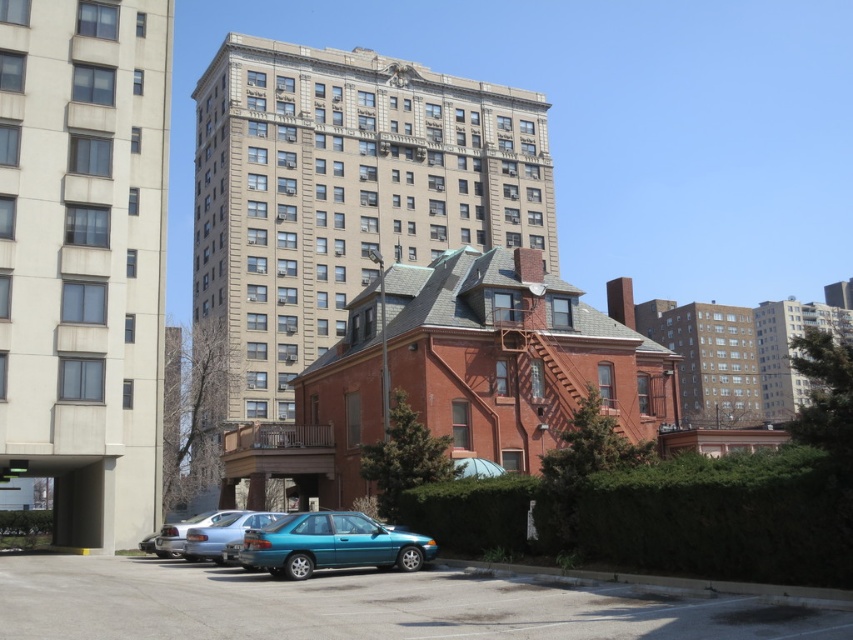
Which is more to the left, beige concrete building at center or teal glossy sedan at lower center?

beige concrete building at center

Who is more forward, (49, 218) or (294, 544)?

Point (294, 544)

The image size is (853, 640). Identify the location of beige concrete building at center. pyautogui.click(x=84, y=259).

What do you see at coordinates (344, 193) in the screenshot? This screenshot has height=640, width=853. I see `beige stone building at center` at bounding box center [344, 193].

Is beige stone building at center shorter than matte silver sedan at lower left?

In fact, beige stone building at center may be taller than matte silver sedan at lower left.

At what (x,y) coordinates should I click in order to perform the action: click on beige stone building at center. Please return your answer as a coordinate pair (x, y). The height and width of the screenshot is (640, 853). Looking at the image, I should click on (344, 193).

Locate an element on the screen. Image resolution: width=853 pixels, height=640 pixels. matte silver sedan at lower left is located at coordinates (223, 532).

Which is above, matte silver sedan at lower left or satin silver sedan at lower left?

matte silver sedan at lower left is higher up.

The height and width of the screenshot is (640, 853). Identify the location of matte silver sedan at lower left. (223, 532).